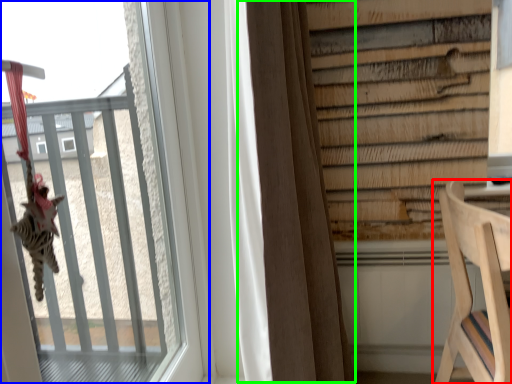
Question: Which is nearer to the furniture (highlighted by a red box)? window (highlighted by a blue box) or curtain (highlighted by a green box).

Choices:
 (A) window
 (B) curtain

Answer: (B)